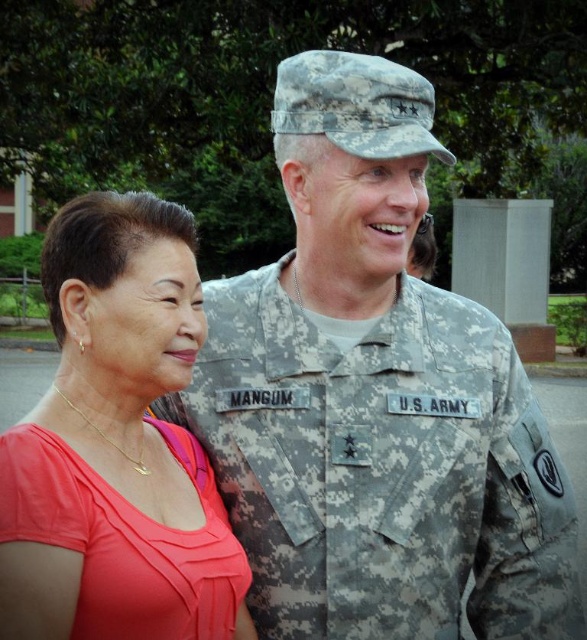
Between matte coral blouse at left and camouflage fabric uniform at center, which one has more height?

matte coral blouse at left is taller.

Is matte coral blouse at left taller than camouflage fabric uniform at center?

Correct, matte coral blouse at left is much taller as camouflage fabric uniform at center.

The image size is (587, 640). What do you see at coordinates (123, 342) in the screenshot?
I see `matte coral blouse at left` at bounding box center [123, 342].

You are a GUI agent. You are given a task and a screenshot of the screen. Output one action in this format:
    pyautogui.click(x=<x>, y=<y>)
    Task: Click on the matte coral blouse at left
    This screenshot has width=587, height=640.
    Given the screenshot: What is the action you would take?
    pyautogui.click(x=123, y=342)

Which is below, camouflage uniform at center or matte coral blouse at left?

Answer: matte coral blouse at left

Consider the image. Does camouflage uniform at center appear on the right side of matte coral blouse at left?

Yes, camouflage uniform at center is to the right of matte coral blouse at left.

Is point (394, 136) more distant than point (129, 300)?

Yes, point (394, 136) is behind point (129, 300).

This screenshot has height=640, width=587. Identify the location of camouflage uniform at center. (375, 397).

Image resolution: width=587 pixels, height=640 pixels. What do you see at coordinates (375, 397) in the screenshot? I see `camouflage uniform at center` at bounding box center [375, 397].

Does point (357, 58) come closer to viewer compared to point (110, 616)?

No, (357, 58) is further to viewer.

Which is behind, point (348, 628) or point (58, 509)?

The point (348, 628) is behind.

At what (x,y) coordinates should I click in order to perform the action: click on camouflage uniform at center. Please return your answer as a coordinate pair (x, y). Looking at the image, I should click on (375, 397).